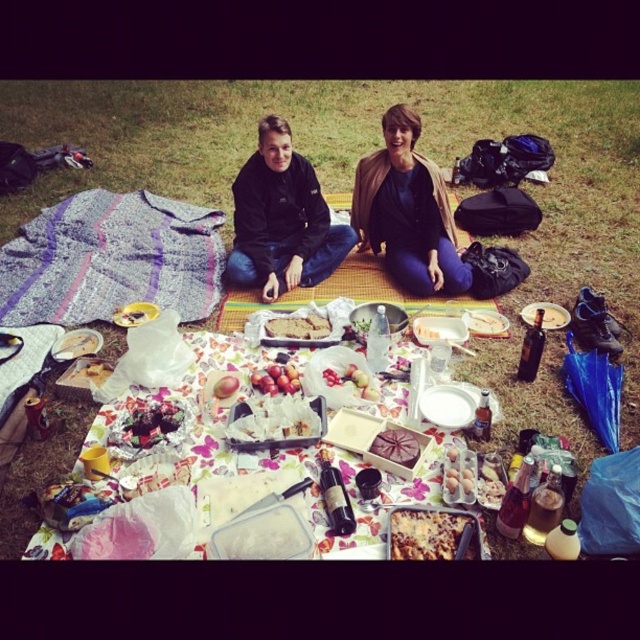
Question: Which is nearer to the matte black jacket at center?

Choices:
 (A) golden brown cheesy casserole at center
 (B) green grass at center

Answer: (B)

Question: Can you confirm if white matte plate at center is positioned below matte white plate at center?

Choices:
 (A) no
 (B) yes

Answer: (B)

Question: Where is green grass at center located in relation to smooth red apple at center in the image?

Choices:
 (A) above
 (B) below

Answer: (A)

Question: Is floral fabric picnic table at center behind white matte plate at center?

Choices:
 (A) yes
 (B) no

Answer: (B)

Question: Which object is the closest to the white paper plate at center?

Choices:
 (A) shiny red apples at center
 (B) blue denim jeans at center
 (C) smooth purple cake at center
 (D) smooth white cake at center

Answer: (D)

Question: Based on their relative distances, which object is farther from the matte black jacket at center?

Choices:
 (A) blue denim jeans at center
 (B) matte plastic bag at center

Answer: (B)